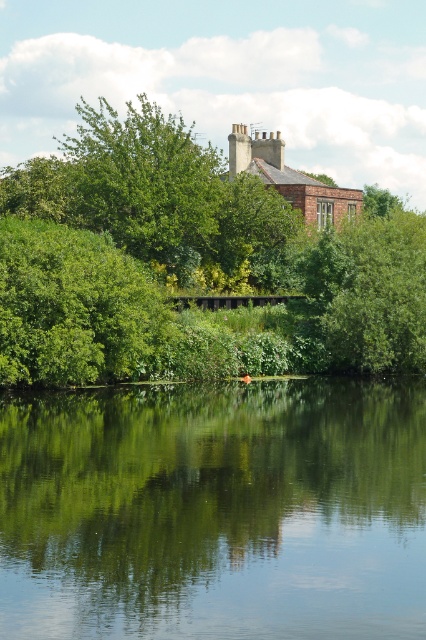
Between point (307, 596) and point (388, 320), which one is positioned behind?

The point (388, 320) is behind.

Which of these two, green reflective water at center or green leafy tree at upper center, stands shorter?

green reflective water at center

Which is behind, point (348, 486) or point (327, 236)?

Positioned behind is point (327, 236).

Where is `green reflective water at center`? This screenshot has width=426, height=640. green reflective water at center is located at coordinates (215, 512).

Which is more to the right, green reflective water at center or green leafy tree at lower left?

Positioned to the right is green reflective water at center.

Based on the photo, is green reflective water at center bigger than green leafy tree at lower left?

No.

Between point (106, 580) and point (48, 310), which one is positioned in front?

Positioned in front is point (106, 580).

Find the location of a particular element. green reflective water at center is located at coordinates (215, 512).

Between green leafy tree at lower left and green leafy tree at upper center, which one has less height?

Standing shorter between the two is green leafy tree at upper center.

The width and height of the screenshot is (426, 640). I want to click on green leafy tree at lower left, so click(195, 260).

Is point (45, 348) positioned behind point (383, 305)?

No, it is in front of (383, 305).

At what (x,y) coordinates should I click in order to perform the action: click on green leafy tree at lower left. Please return your answer as a coordinate pair (x, y). Looking at the image, I should click on (195, 260).